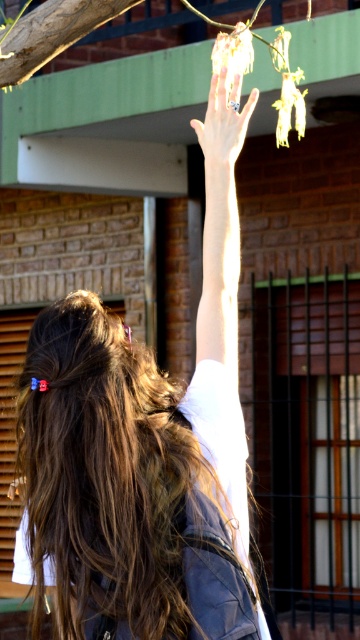
You are an artist sketching this scene. You need to decide which object to draw first based on their sizes. Which one should you start with, the light brown hair at upper center or the matte black hand at upper center?

The light brown hair at upper center has a larger size compared to the matte black hand at upper center, so you should start with the light brown hair at upper center because it is bigger and might require more detailed work.

You are a photographer trying to capture the light brown hair at upper center and the silver metallic ring at upper center in the same frame. Which object will appear bigger in your photo?

The light brown hair at upper center will appear bigger in the photo because it is larger in size than the silver metallic ring at upper center.

You are standing at the point with coordinates point (7, 492) and want to walk towards the point (198, 592). Will you have to move forward or backward to get closer to the destination?

Since point (198, 592) is in front of point (7, 492), you will have to move forward to get closer to the destination.